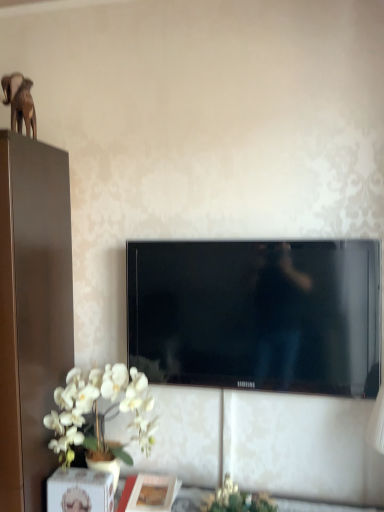
Where is `vacant space situated above matte white picture frame at lower center (from a real-world perspective)`? vacant space situated above matte white picture frame at lower center (from a real-world perspective) is located at coordinates (144, 486).